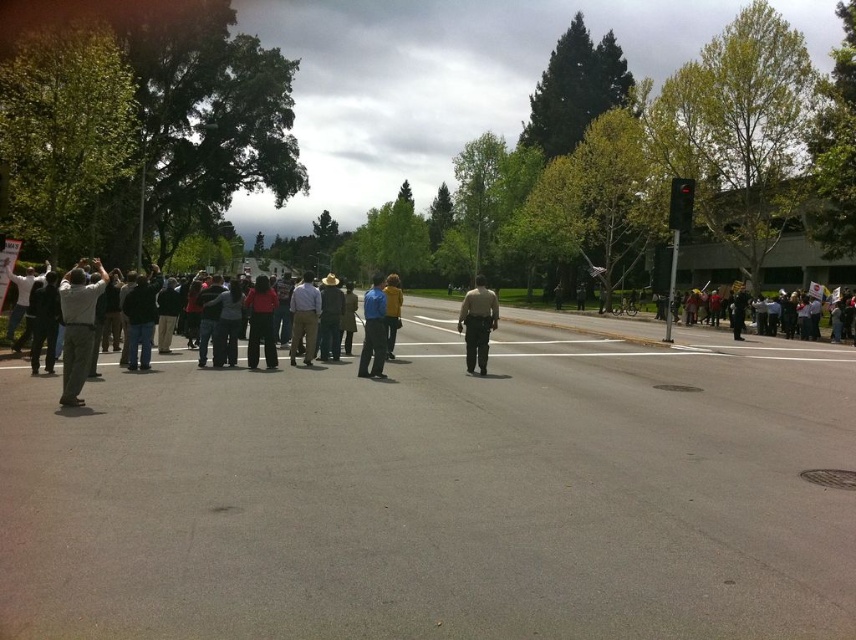
You are a pedestrian trying to cross the road. You see the yellow matte jacket at center and the black plastic traffic light at upper center. Which object takes up more space in the scene?

The black plastic traffic light at upper center takes up more space in the scene than the yellow matte jacket at center, as it occupies more area according to the description.

You are a pedestrian standing at the edge of the road. You see the yellow matte jacket at center and the black plastic traffic light at upper center. If you want to reach the traffic light, which direction should you walk towards?

The yellow matte jacket at center is 16.14 meters away from the black plastic traffic light at upper center. To reach the traffic light, you should walk towards the upper center direction from your current position at the edge of the road.

You are a pedestrian standing on the sidewalk and see the dark gray pants at left and the blue shirt at center. Which person is shorter?

The dark gray pants at left is not as tall as blue shirt at center, so the person wearing dark gray pants at left is shorter.